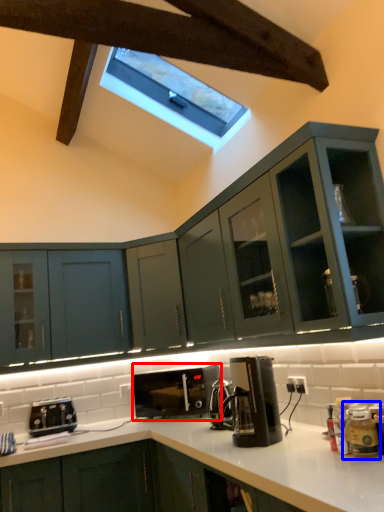
Question: Which object appears farthest to the camera in this image, home appliance (highlighted by a red box) or appliance (highlighted by a blue box)?

Choices:
 (A) home appliance
 (B) appliance

Answer: (A)